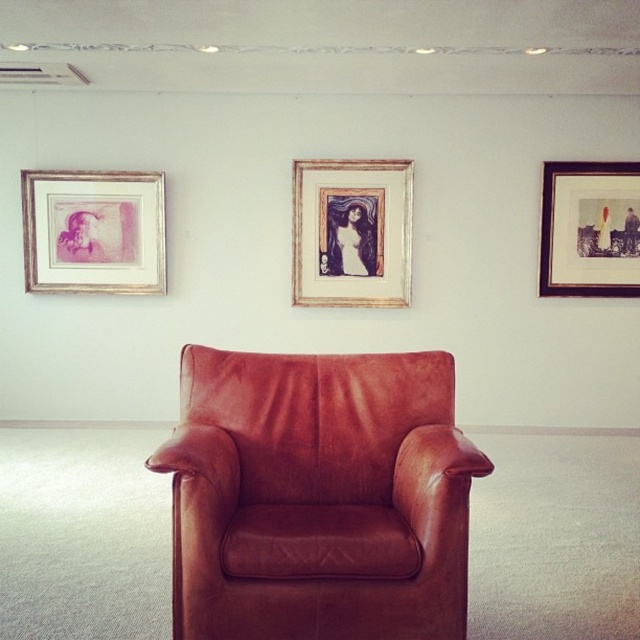
You are standing in the room described in the scene. If you want to move directly towards the brown leather armchair at center, which direction should you walk?

Since the brown leather armchair at center is positioned at point coordinates of 0.778 on the x and 0.498 on the y, you should walk towards the center of the room where the brown leather armchair at center is located.

You are standing in the room and want to sit down. Which object is the point at coordinate (317,497) located on?

The point at coordinate (317,497) is located on the brown leather armchair at center.